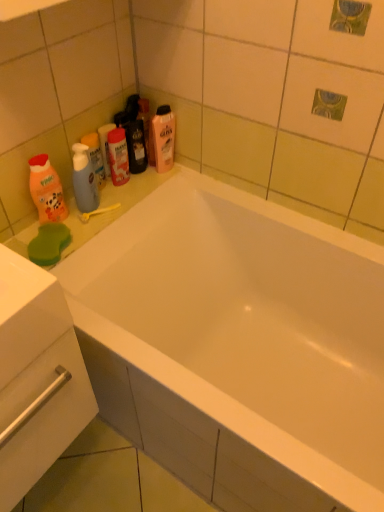
The height and width of the screenshot is (512, 384). Find the location of `vacant space in front of translucent plastic mouthwash at upper center, marked as the second mouthwash in a left-to-right arrangement`. vacant space in front of translucent plastic mouthwash at upper center, marked as the second mouthwash in a left-to-right arrangement is located at coordinates (111, 203).